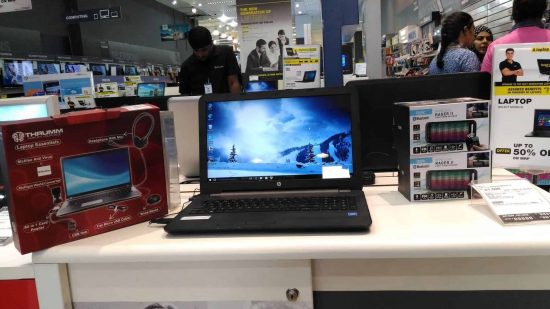
Locate an element on the screen. The image size is (550, 309). silver lock is located at coordinates (291, 293).